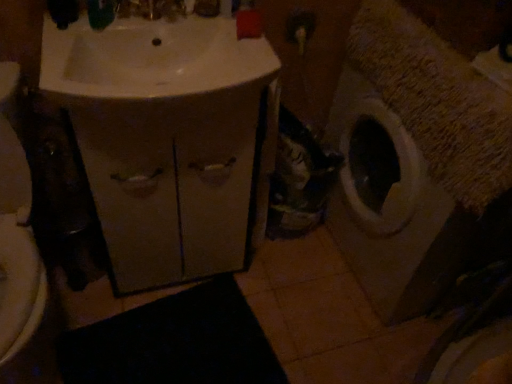
Question: Can you confirm if matte beige cabinet at center is shorter than white glossy sink at upper left?

Choices:
 (A) yes
 (B) no

Answer: (B)

Question: Does matte beige cabinet at center appear on the right side of white glossy sink at upper left?

Choices:
 (A) no
 (B) yes

Answer: (A)

Question: From the image's perspective, is matte beige cabinet at center over white glossy sink at upper left?

Choices:
 (A) yes
 (B) no

Answer: (B)

Question: Is matte beige cabinet at center thinner than white glossy sink at upper left?

Choices:
 (A) no
 (B) yes

Answer: (B)

Question: Would you consider matte beige cabinet at center to be distant from white glossy sink at upper left?

Choices:
 (A) yes
 (B) no

Answer: (B)

Question: Is white glossy sink at upper left at the back of matte beige cabinet at center?

Choices:
 (A) yes
 (B) no

Answer: (B)

Question: From a real-world perspective, is black rubber bath mat at lower center over textured beige washing machine at right?

Choices:
 (A) yes
 (B) no

Answer: (B)

Question: Is black rubber bath mat at lower center shorter than textured beige washing machine at right?

Choices:
 (A) no
 (B) yes

Answer: (B)

Question: From a real-world perspective, does black rubber bath mat at lower center sit lower than textured beige washing machine at right?

Choices:
 (A) yes
 (B) no

Answer: (A)

Question: Would you say black rubber bath mat at lower center is outside textured beige washing machine at right?

Choices:
 (A) no
 (B) yes

Answer: (B)

Question: Can textured beige washing machine at right be found inside black rubber bath mat at lower center?

Choices:
 (A) no
 (B) yes

Answer: (A)

Question: From the image's perspective, is black rubber bath mat at lower center below textured beige washing machine at right?

Choices:
 (A) yes
 (B) no

Answer: (A)

Question: Is textured beige washing machine at right looking in the opposite direction of black rubber bath mat at lower center?

Choices:
 (A) no
 (B) yes

Answer: (A)